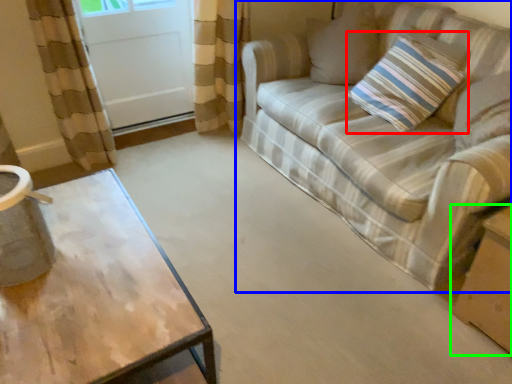
Question: Considering the real-world distances, which object is farthest from pillow (highlighted by a red box)? studio couch (highlighted by a blue box) or cardboard box (highlighted by a green box)?

Choices:
 (A) studio couch
 (B) cardboard box

Answer: (B)